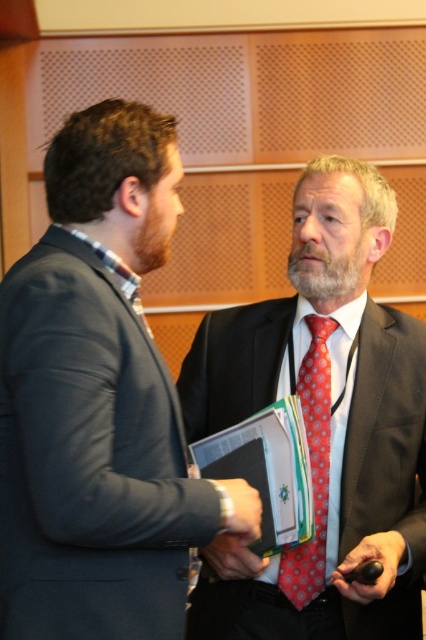
You are a photographer setting up for a group photo in the conference room. You need to position two people wearing matte black suits so that there is exactly 24 inches between them. Currently, the matte black suit at left and the matte black suit at center are positioned 19.14 inches apart. Can you adjust their positions to meet the requirement?

The current distance between the matte black suit at left and the matte black suit at center is 19.14 inches. To achieve the required 24 inches, you need to increase the distance between them by 4.86 inches. This can be done by moving one or both individuals further apart until the desired spacing is reached.

You are a photographer positioned in front of the two individuals. You want to take a photo that includes both the matte black suit at left and the red dotted tie at center. What is the minimum distance you need to adjust your camera lens to ensure both subjects are in frame?

The minimum distance required is 24.31 inches to ensure both the matte black suit at left and the red dotted tie at center are in frame since they are 24.31 inches apart.